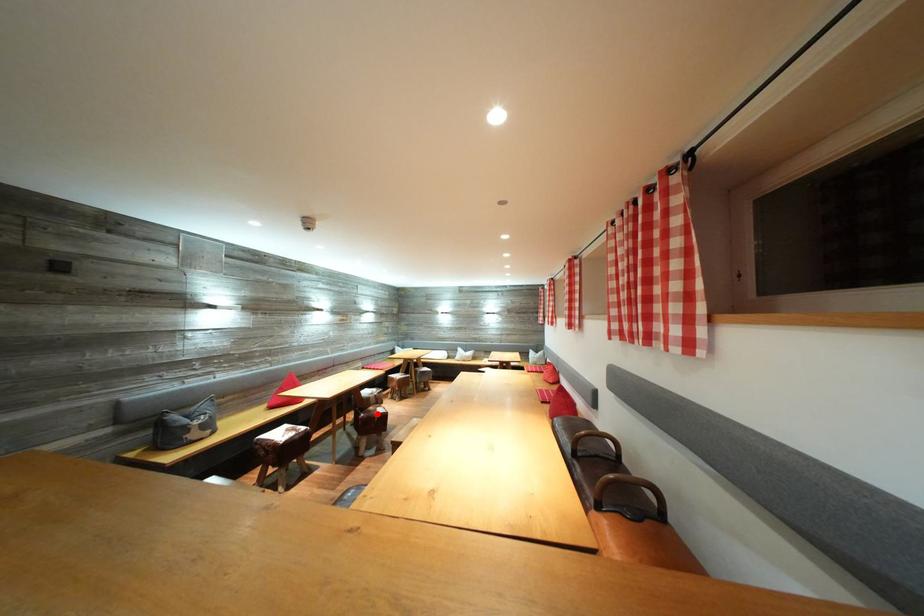
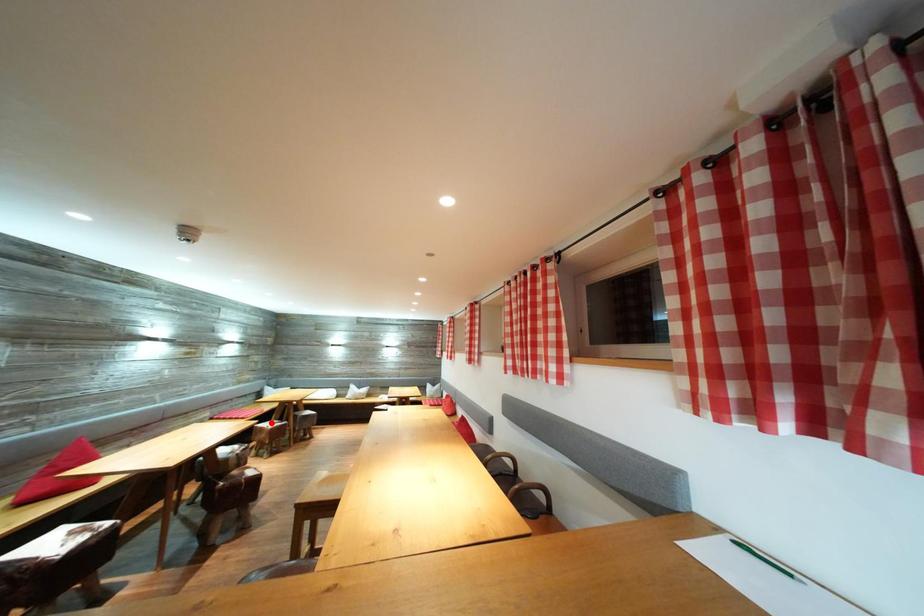
I am providing you with two images of the same scene from different viewpoints. A red point is marked on the first image and another point is marked on the second image. Are the points marked in image1 and image2 representing the same 3D position?

No